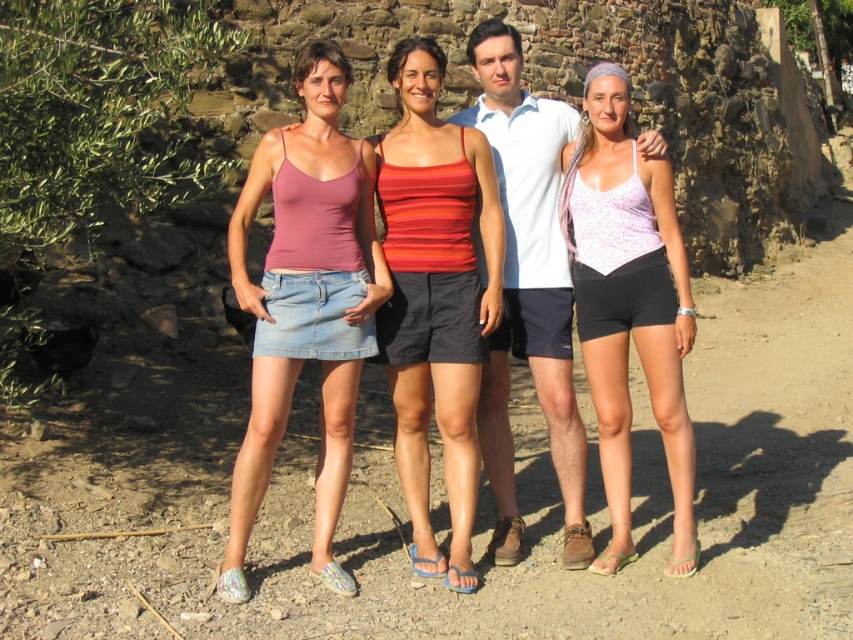
You are a photographer trying to capture a clear shot of the purple floral tank top at center without the pink denim skirt at lower left blocking it. Based on the scene, is this possible?

The pink denim skirt at lower left is in front of the purple floral tank top at center, so it would block the view. To capture a clear shot of the purple floral tank top at center, you would need to adjust your angle or have the subject move to avoid the obstruction.

Based on the photo, based on the scene description, which object is taller between the pink denim skirt at lower left and the purple floral tank top at center?

The pink denim skirt at lower left is much taller than the purple floral tank top at center according to the description.